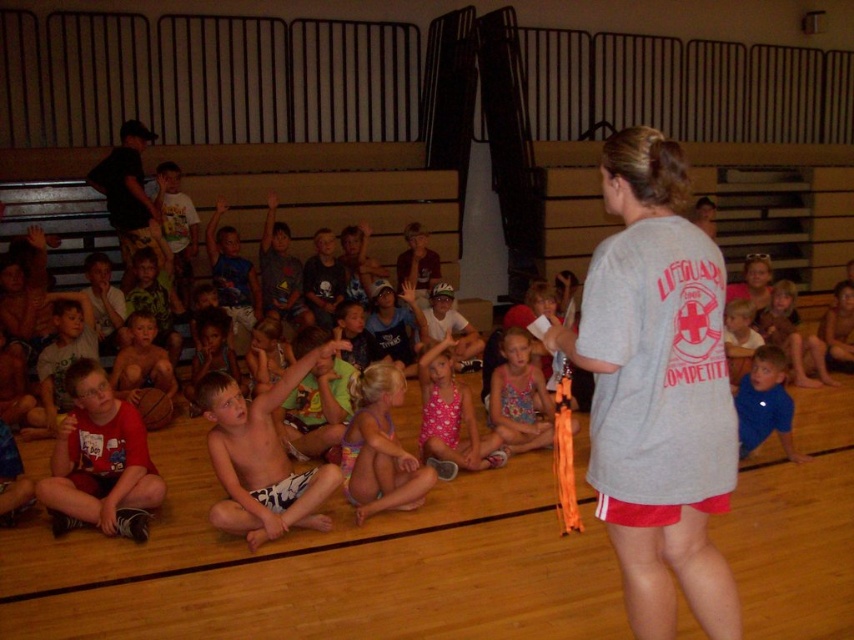
Question: Estimate the real-world distances between objects in this image. Which object is closer to the gray cotton t-shirt at center?

Choices:
 (A) black cotton shirt at upper left
 (B) red shirt at center
 (C) floral swimsuit at lower right

Answer: (B)

Question: Can you confirm if floral fabric dress at center is smaller than shiny blue shorts at center?

Choices:
 (A) no
 (B) yes

Answer: (B)

Question: From the image, what is the correct spatial relationship of pink fabric swimsuit at center in relation to black cotton shirt at upper left?

Choices:
 (A) right
 (B) left

Answer: (A)

Question: Among these points, which one is farthest from the camera?

Choices:
 (A) (120, 180)
 (B) (332, 269)
 (C) (142, 378)
 (D) (788, 372)

Answer: (B)

Question: Considering the real-world distances, which object is closest to the floral fabric dress at center?

Choices:
 (A) shiny blue shorts at center
 (B) red cotton shirt at lower left

Answer: (B)

Question: Is pink fabric swimsuit at center above floral fabric dress at center?

Choices:
 (A) yes
 (B) no

Answer: (B)